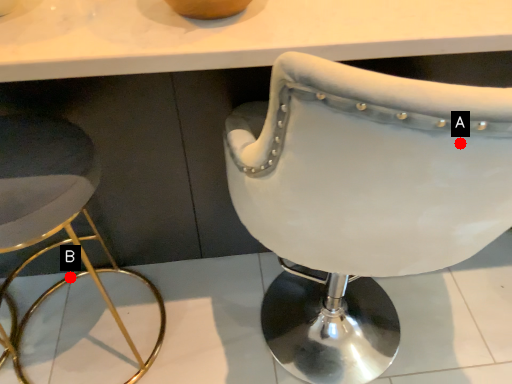
Question: Two points are circled on the image, labeled by A and B beside each circle. Which point is farther from the camera taking this photo?

Choices:
 (A) A is further
 (B) B is further

Answer: (B)